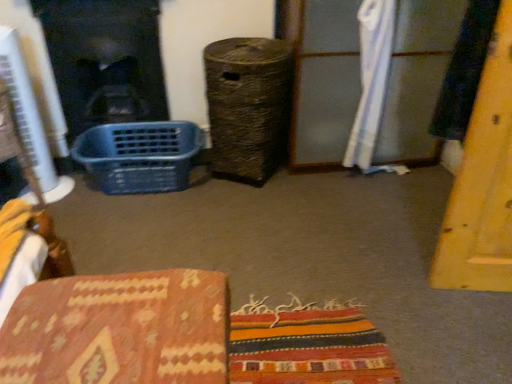
Question: Is blue plastic basket at left oriented away from black glass fireplace at left?

Choices:
 (A) no
 (B) yes

Answer: (B)

Question: Can you confirm if blue plastic basket at left is thinner than black glass fireplace at left?

Choices:
 (A) yes
 (B) no

Answer: (B)

Question: Is blue plastic basket at left outside of black glass fireplace at left?

Choices:
 (A) yes
 (B) no

Answer: (A)

Question: From the image's perspective, is blue plastic basket at left over black glass fireplace at left?

Choices:
 (A) no
 (B) yes

Answer: (A)

Question: Can you confirm if blue plastic basket at left is positioned to the left of black glass fireplace at left?

Choices:
 (A) yes
 (B) no

Answer: (B)

Question: Is white fabric curtain at upper right bigger or smaller than blue plastic basket at left?

Choices:
 (A) small
 (B) big

Answer: (A)

Question: From a real-world perspective, is white fabric curtain at upper right physically located above or below blue plastic basket at left?

Choices:
 (A) below
 (B) above

Answer: (B)

Question: Considering their positions, is white fabric curtain at upper right located in front of or behind blue plastic basket at left?

Choices:
 (A) front
 (B) behind

Answer: (A)

Question: In terms of width, does white fabric curtain at upper right look wider or thinner when compared to blue plastic basket at left?

Choices:
 (A) thin
 (B) wide

Answer: (A)

Question: Considering the positions of point (361, 41) and point (65, 99), is point (361, 41) closer or farther from the camera than point (65, 99)?

Choices:
 (A) closer
 (B) farther

Answer: (A)

Question: In terms of height, does white fabric curtain at upper right look taller or shorter compared to black glass fireplace at left?

Choices:
 (A) short
 (B) tall

Answer: (B)

Question: Looking at the image, does white fabric curtain at upper right seem bigger or smaller compared to black glass fireplace at left?

Choices:
 (A) big
 (B) small

Answer: (B)

Question: Considering the relative positions of white fabric curtain at upper right and black glass fireplace at left in the image provided, is white fabric curtain at upper right to the left or to the right of black glass fireplace at left?

Choices:
 (A) right
 (B) left

Answer: (A)

Question: From the image's perspective, is blue plastic basket at left above or below black glass fireplace at left?

Choices:
 (A) above
 (B) below

Answer: (B)

Question: Is blue plastic basket at left bigger or smaller than black glass fireplace at left?

Choices:
 (A) small
 (B) big

Answer: (A)